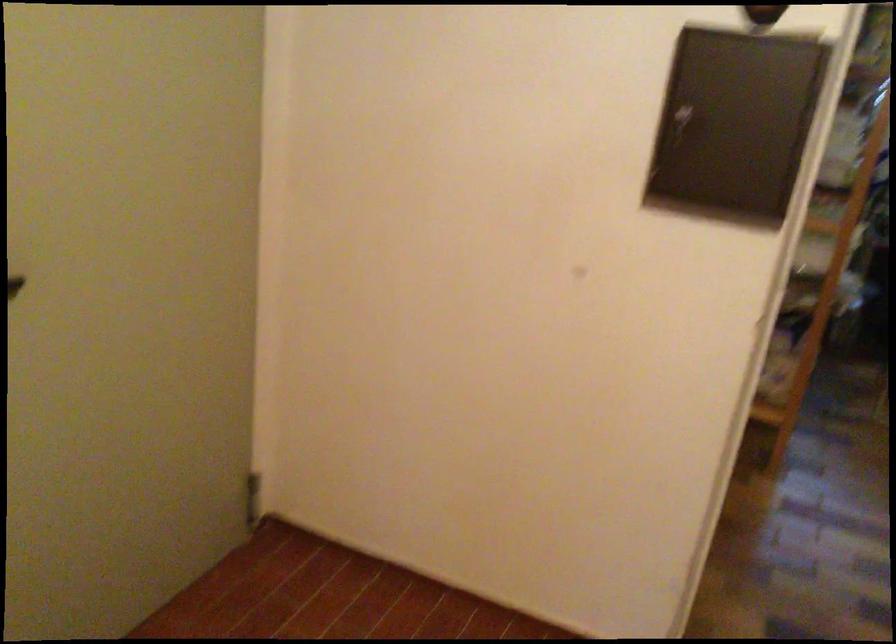
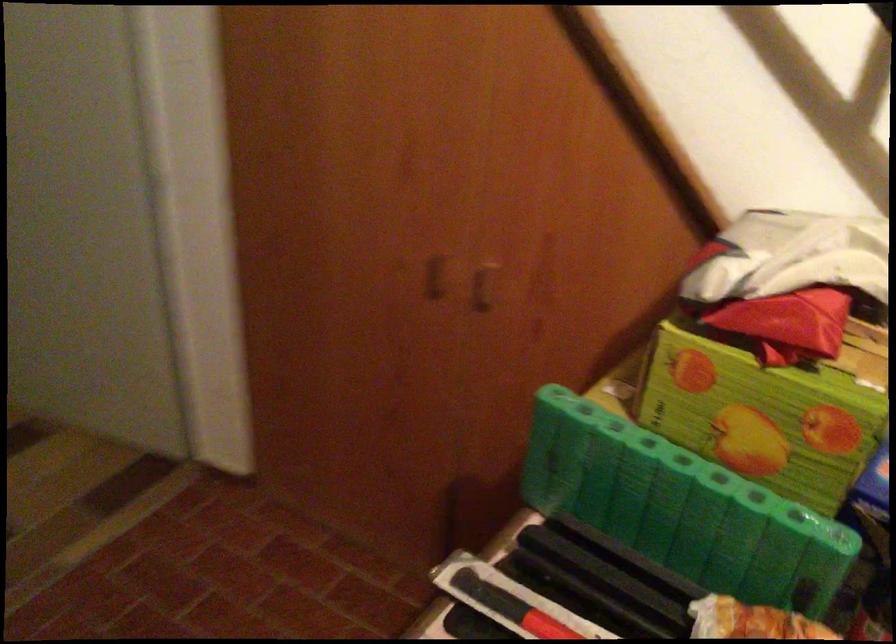
The images are taken continuously from a first-person perspective. In which direction is your viewpoint rotating?

The camera rotated toward right-down.